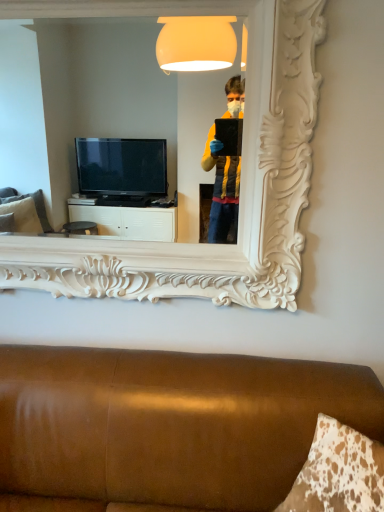
In order to face white carved mirror at upper center, should I rotate leftwards or rightwards?

You should look left and rotate roughly 7.227 degrees.

What is the approximate height of white carved mirror at upper center?

white carved mirror at upper center is 3.45 feet in height.

This screenshot has width=384, height=512. Describe the element at coordinates (240, 198) in the screenshot. I see `white carved mirror at upper center` at that location.

Where is `white carved mirror at upper center`? This screenshot has height=512, width=384. white carved mirror at upper center is located at coordinates (240, 198).

Identify the location of brown leather couch at lower center. This screenshot has width=384, height=512. (166, 426).

What do you see at coordinates (166, 426) in the screenshot? I see `brown leather couch at lower center` at bounding box center [166, 426].

Where is `white carved mirror at upper center`? This screenshot has height=512, width=384. white carved mirror at upper center is located at coordinates (x=240, y=198).

Which is more to the right, white carved mirror at upper center or brown leather couch at lower center?

Positioned to the right is brown leather couch at lower center.

Is white carved mirror at upper center in front of or behind brown leather couch at lower center in the image?

white carved mirror at upper center is positioned farther from the viewer than brown leather couch at lower center.

Considering the points (314, 25) and (250, 462), which point is behind, point (314, 25) or point (250, 462)?

The point (314, 25) is farther from the camera.

From the image's perspective, is white carved mirror at upper center above or below brown leather couch at lower center?

From the image's perspective, white carved mirror at upper center appears above brown leather couch at lower center.

From a real-world perspective, which is physically above, white carved mirror at upper center or brown leather couch at lower center?

From a 3D spatial view, white carved mirror at upper center is above.

Can you confirm if white carved mirror at upper center is thinner than brown leather couch at lower center?

Indeed, white carved mirror at upper center has a lesser width compared to brown leather couch at lower center.

Considering the relative sizes of white carved mirror at upper center and brown leather couch at lower center in the image provided, is white carved mirror at upper center shorter than brown leather couch at lower center?

In fact, white carved mirror at upper center may be taller than brown leather couch at lower center.

Which of these two, white carved mirror at upper center or brown leather couch at lower center, is bigger?

With larger size is brown leather couch at lower center.

Is white carved mirror at upper center surrounding brown leather couch at lower center?

No, brown leather couch at lower center is located outside of white carved mirror at upper center.

Is white carved mirror at upper center next to brown leather couch at lower center and touching it?

No, white carved mirror at upper center is not beside brown leather couch at lower center.

Is white carved mirror at upper center turned away from brown leather couch at lower center?

No, brown leather couch at lower center is not at the back of white carved mirror at upper center.

What's the angular difference between white carved mirror at upper center and brown leather couch at lower center's facing directions?

The facing directions of white carved mirror at upper center and brown leather couch at lower center are 0.868 degrees apart.

Measure the distance between white carved mirror at upper center and brown leather couch at lower center.

19.56 inches.

I want to click on mirror that is on the left side of brown leather couch at lower center, so click(240, 198).

Considering the positions of objects brown leather couch at lower center and white carved mirror at upper center in the image provided, who is more to the right, brown leather couch at lower center or white carved mirror at upper center?

From the viewer's perspective, brown leather couch at lower center appears more on the right side.

Is brown leather couch at lower center positioned before white carved mirror at upper center?

Yes, brown leather couch at lower center is closer to the camera.

Is point (17, 490) positioned in front of point (15, 262)?

Yes.

From the image's perspective, would you say brown leather couch at lower center is shown under white carved mirror at upper center?

Yes, from the image's perspective, brown leather couch at lower center is beneath white carved mirror at upper center.

From a real-world perspective, is brown leather couch at lower center beneath white carved mirror at upper center?

Correct, in the physical world, brown leather couch at lower center is lower than white carved mirror at upper center.

Is brown leather couch at lower center wider or thinner than white carved mirror at upper center?

Considering their sizes, brown leather couch at lower center looks broader than white carved mirror at upper center.

Considering the sizes of objects brown leather couch at lower center and white carved mirror at upper center in the image provided, who is shorter, brown leather couch at lower center or white carved mirror at upper center?

With less height is brown leather couch at lower center.

Does brown leather couch at lower center have a smaller size compared to white carved mirror at upper center?

Actually, brown leather couch at lower center might be larger than white carved mirror at upper center.

Is brown leather couch at lower center completely or partially outside of white carved mirror at upper center?

brown leather couch at lower center lies outside white carved mirror at upper center's area.

Is brown leather couch at lower center beside white carved mirror at upper center?

brown leather couch at lower center and white carved mirror at upper center are not in contact.

Is brown leather couch at lower center facing towards white carved mirror at upper center?

No, brown leather couch at lower center does not turn towards white carved mirror at upper center.

Looking at this image, can you tell me how much brown leather couch at lower center and white carved mirror at upper center differ in facing direction?

0.868 degrees separate the facing orientations of brown leather couch at lower center and white carved mirror at upper center.

Image resolution: width=384 pixels, height=512 pixels. I want to click on mirror located above the brown leather couch at lower center (from the image's perspective), so click(240, 198).

Identify the location of mirror lying above the brown leather couch at lower center (from the image's perspective). (240, 198).

Find the location of a particular element. This screenshot has height=512, width=384. mirror above the brown leather couch at lower center (from a real-world perspective) is located at coordinates (240, 198).